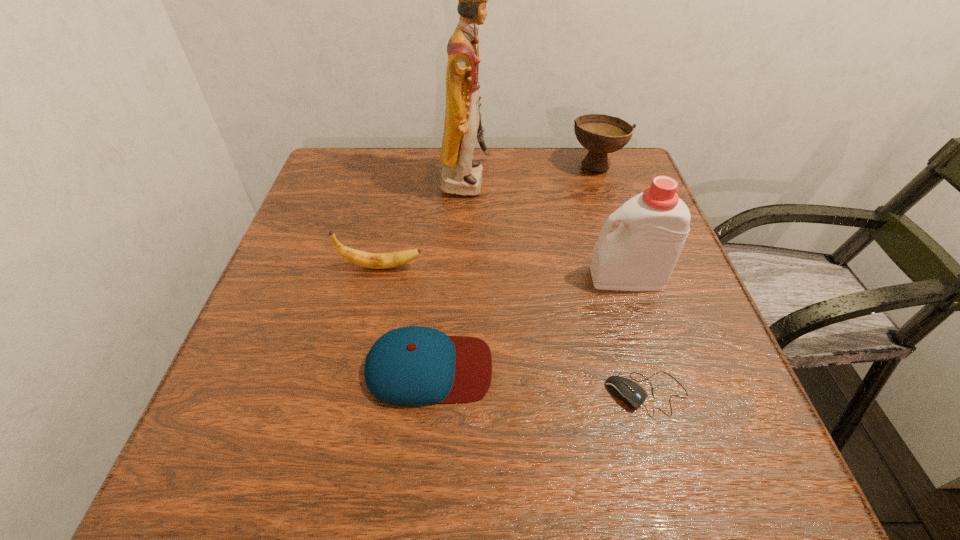
Where is `the tallest object`? The image size is (960, 540). the tallest object is located at coordinates (461, 175).

At what (x,y) coordinates should I click in order to perform the action: click on the second tallest object. Please return your answer as a coordinate pair (x, y). Image resolution: width=960 pixels, height=540 pixels. Looking at the image, I should click on (640, 255).

This screenshot has width=960, height=540. I want to click on the fourth shortest object, so click(x=601, y=134).

Identify the location of the third shortest object. (364, 259).

Where is `baseball cap`? baseball cap is located at coordinates click(x=411, y=366).

Where is `computer mouse`? This screenshot has width=960, height=540. computer mouse is located at coordinates (632, 394).

At what (x,y) coordinates should I click in order to perform the action: click on free space located on the front-facing side of the tallest object. Please return your answer as a coordinate pair (x, y). Looking at the image, I should click on (641, 180).

In order to click on free region located on the handle side of the fifth shortest object in this screenshot , I will do click(428, 278).

Locate an element on the screen. The image size is (960, 540). vacant space located 0.310m on the handle side of the fifth shortest object is located at coordinates (433, 278).

Image resolution: width=960 pixels, height=540 pixels. I want to click on vacant position located 0.320m on the handle side of the fifth shortest object, so click(x=428, y=278).